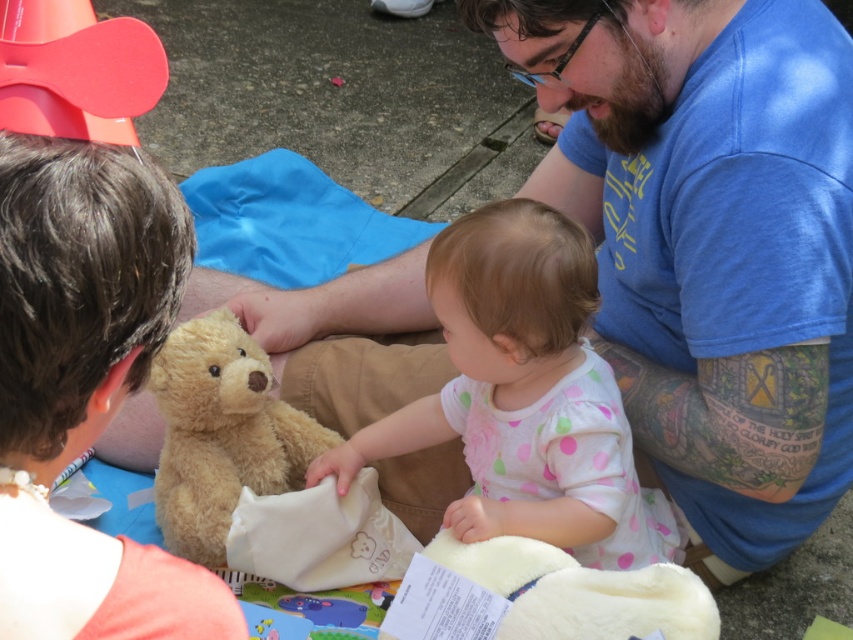
You are a photographer trying to capture the baby and the teddy bear in the image. The teddy bear is at point (524, 396). Where should you focus your camera to ensure the teddy bear is in sharp focus?

You should focus your camera on the point (524, 396) because that is where the teddy bear is located, and the point is on the soft white fabric at center which is part of the teddy bear.

You are a photographer trying to capture the baby and the teddy bear in the scene. The blue cotton shirt at center is covering part of the soft white fabric at center. To ensure both the baby and the teddy bear are fully visible in your photo, which object should you adjust or move?

You should adjust or move the blue cotton shirt at center because it is in front of the soft white fabric at center, which might be blocking the view of the teddy bear or the baby. Moving the blue cotton shirt at center would allow both objects to be fully visible.